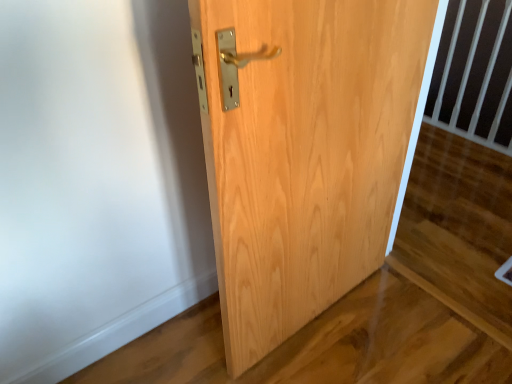
At what (x,y) coordinates should I click in order to perform the action: click on vacant space in natural wood door at center (from a real-world perspective). Please return your answer as a coordinate pair (x, y). This screenshot has width=512, height=384. Looking at the image, I should click on (308, 316).